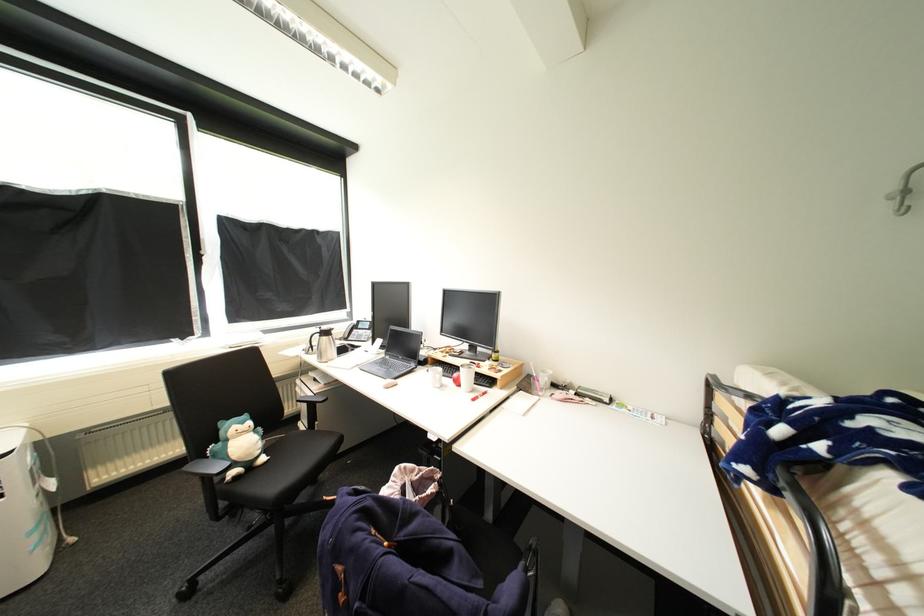
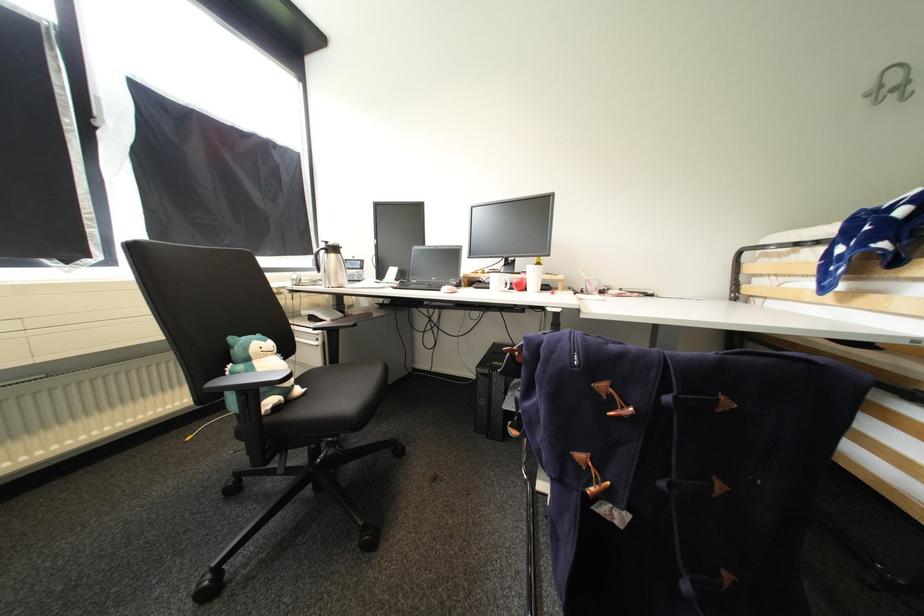
Where in the second image is the point corresponding to point (346, 570) from the first image?

(610, 387)